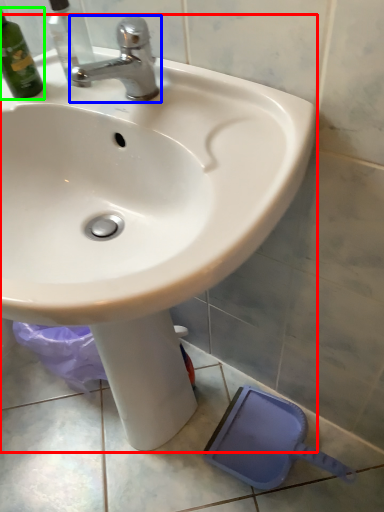
Question: Estimate the real-world distances between objects in this image. Which object is farther from sink (highlighted by a red box), tap (highlighted by a blue box) or bottle (highlighted by a green box)?

Choices:
 (A) tap
 (B) bottle

Answer: (B)